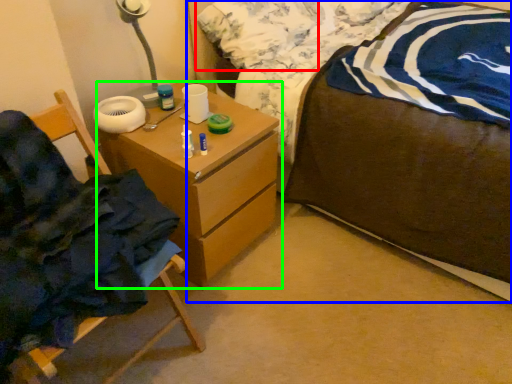
Question: Which object is positioned closest to pillow (highlighted by a red box)? Select from bed (highlighted by a blue box) and chest of drawers (highlighted by a green box).

Choices:
 (A) bed
 (B) chest of drawers

Answer: (A)